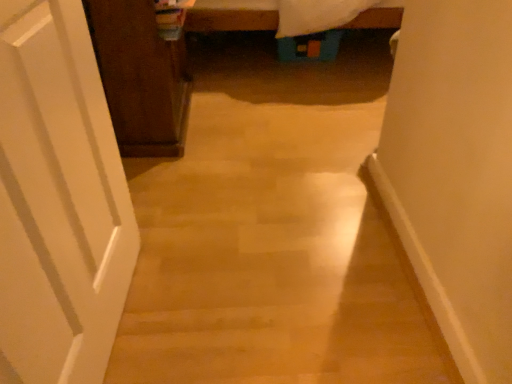
What is the approximate width of white matte door at left?

white matte door at left is 4.99 inches wide.

This screenshot has height=384, width=512. Find the location of `white matte door at left`. white matte door at left is located at coordinates (59, 199).

Image resolution: width=512 pixels, height=384 pixels. What do you see at coordinates (59, 199) in the screenshot?
I see `white matte door at left` at bounding box center [59, 199].

Consider the image. Measure the distance between point (96,117) and camera.

The distance of point (96,117) from camera is 96.50 centimeters.

The image size is (512, 384). What do you see at coordinates (140, 77) in the screenshot?
I see `dark wood cabinet at left` at bounding box center [140, 77].

Locate an element on the screen. This screenshot has height=384, width=512. dark wood cabinet at left is located at coordinates (140, 77).

The width and height of the screenshot is (512, 384). Find the location of `white matte door at left`. white matte door at left is located at coordinates (59, 199).

Is white matte door at left at the right side of dark wood cabinet at left?

Indeed, white matte door at left is positioned on the right side of dark wood cabinet at left.

Is white matte door at left in front of dark wood cabinet at left?

Yes.

Which is further, (106, 258) or (119, 113)?

Positioned behind is point (119, 113).

From the image's perspective, who appears lower, white matte door at left or dark wood cabinet at left?

white matte door at left, from the image's perspective.

From a real-world perspective, which is physically below, white matte door at left or dark wood cabinet at left?

In real-world perspective, dark wood cabinet at left is lower.

In the scene shown: Between white matte door at left and dark wood cabinet at left, which one has larger width?

Wider between the two is dark wood cabinet at left.

Considering the sizes of white matte door at left and dark wood cabinet at left in the image, is white matte door at left taller or shorter than dark wood cabinet at left?

white matte door at left is taller than dark wood cabinet at left.

Does white matte door at left have a smaller size compared to dark wood cabinet at left?

Yes.

Is dark wood cabinet at left completely or partially inside white matte door at left?

Definitely not — dark wood cabinet at left is not inside white matte door at left.

Is white matte door at left positioned far away from dark wood cabinet at left?

white matte door at left is near dark wood cabinet at left, not far away.

Is white matte door at left oriented towards dark wood cabinet at left?

No, white matte door at left is not oriented towards dark wood cabinet at left.

At what (x,y) coordinates should I click in order to perform the action: click on door located on the right of dark wood cabinet at left. Please return your answer as a coordinate pair (x, y). The width and height of the screenshot is (512, 384). Looking at the image, I should click on (59, 199).

Consider the image. Considering the relative positions of dark wood cabinet at left and white matte door at left in the image provided, is dark wood cabinet at left to the right of white matte door at left from the viewer's perspective?

Incorrect, dark wood cabinet at left is not on the right side of white matte door at left.

Is dark wood cabinet at left in front of or behind white matte door at left in the image?

Visually, dark wood cabinet at left is located behind white matte door at left.

Does point (181, 87) come behind point (109, 242)?

Yes, point (181, 87) is farther from viewer.

From the image's perspective, which one is positioned lower, dark wood cabinet at left or white matte door at left?

From the image's view, white matte door at left is below.

From a real-world perspective, which is physically above, dark wood cabinet at left or white matte door at left?

white matte door at left is physically above.

In the scene shown: Can you confirm if dark wood cabinet at left is thinner than white matte door at left?

In fact, dark wood cabinet at left might be wider than white matte door at left.

Who is shorter, dark wood cabinet at left or white matte door at left?

With less height is dark wood cabinet at left.

Is dark wood cabinet at left smaller than white matte door at left?

Actually, dark wood cabinet at left might be larger than white matte door at left.

Is dark wood cabinet at left outside of white matte door at left?

Indeed, dark wood cabinet at left is completely outside white matte door at left.

Is dark wood cabinet at left not near white matte door at left?

dark wood cabinet at left is actually quite close to white matte door at left.

In the scene shown: Is white matte door at left at the back of dark wood cabinet at left?

No.

What's the angular difference between dark wood cabinet at left and white matte door at left's facing directions?

The angle between the facing direction of dark wood cabinet at left and the facing direction of white matte door at left is 2 degrees.

Looking at this image, measure the distance from dark wood cabinet at left to white matte door at left.

The distance of dark wood cabinet at left from white matte door at left is 27.22 inches.

Identify the location of cabinetry on the left of white matte door at left. The height and width of the screenshot is (384, 512). (140, 77).

Identify the location of cabinetry behind the white matte door at left. (140, 77).

Identify the location of door on the right of dark wood cabinet at left. The image size is (512, 384). (59, 199).